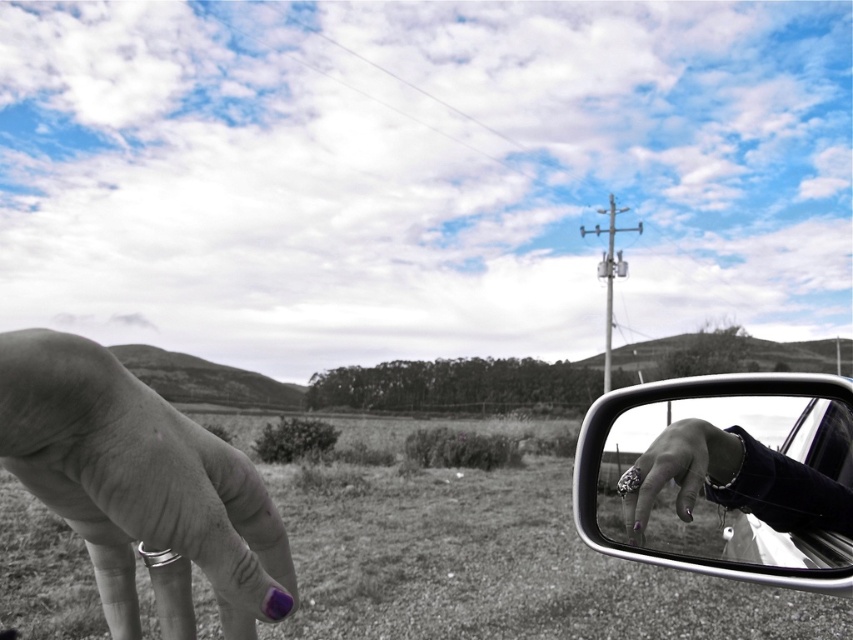
You are a driver checking your side mirror and notice both the metallic reflective mirror at right and the black leather glove at right in your view. Which object appears bigger in your line of sight?

The metallic reflective mirror at right appears bigger in your line of sight because it has a larger size compared to the black leather glove at right.